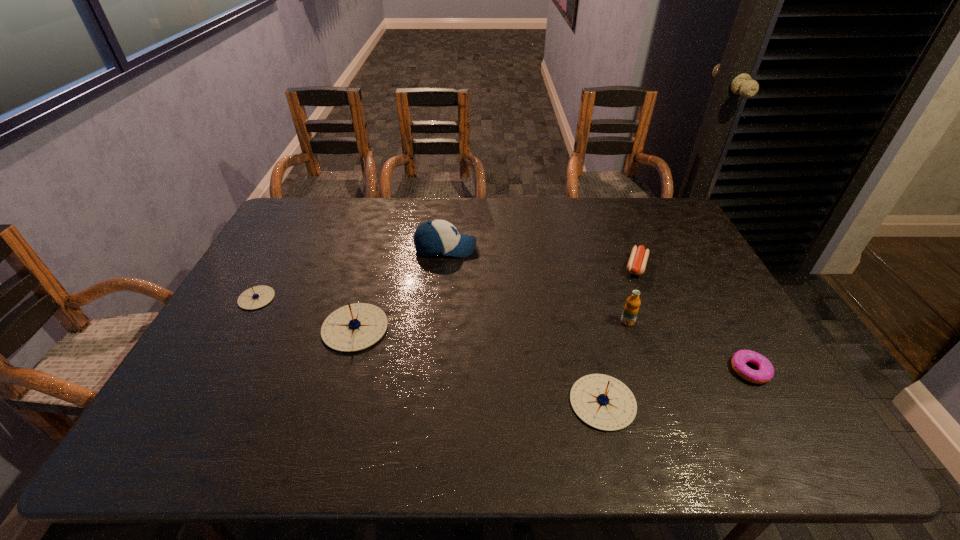
Locate an element on the screen. This screenshot has width=960, height=540. the fifth object from left to right is located at coordinates tap(631, 308).

This screenshot has width=960, height=540. Find the location of `free location located on the right of the fifth tallest object`. free location located on the right of the fifth tallest object is located at coordinates (295, 298).

At what (x,y) coordinates should I click in order to perform the action: click on vacant space located on the right of the second object from left to right. Please return your answer as a coordinate pair (x, y). Looking at the image, I should click on (502, 328).

Locate an element on the screen. free space located on the left of the second shortest compass is located at coordinates (548, 402).

The height and width of the screenshot is (540, 960). In order to click on vacant region located on the back of the sausage in this screenshot , I will do `click(622, 232)`.

Image resolution: width=960 pixels, height=540 pixels. I want to click on free space located 0.380m on the front-facing side of the fifth object from right to left, so click(x=591, y=248).

The image size is (960, 540). Identify the location of free space located on the left of the rightmost object. (707, 370).

This screenshot has width=960, height=540. Identify the location of free location located 0.170m on the label of the fifth object from left to right. (647, 379).

Locate an element on the screen. compass positioned at the near edge is located at coordinates (603, 402).

The height and width of the screenshot is (540, 960). Find the location of `doughnut situated at the near edge`. doughnut situated at the near edge is located at coordinates (765, 373).